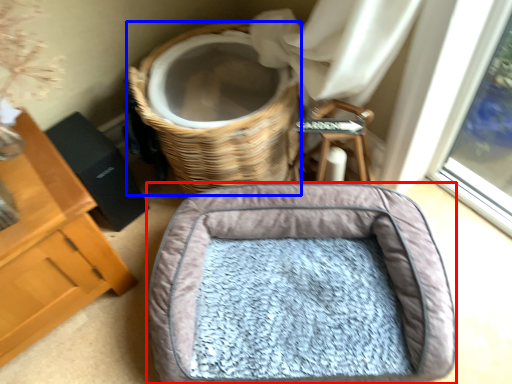
Question: Which object appears closest to the camera in this image, dog bed (highlighted by a red box) or basket (highlighted by a blue box)?

Choices:
 (A) dog bed
 (B) basket

Answer: (A)